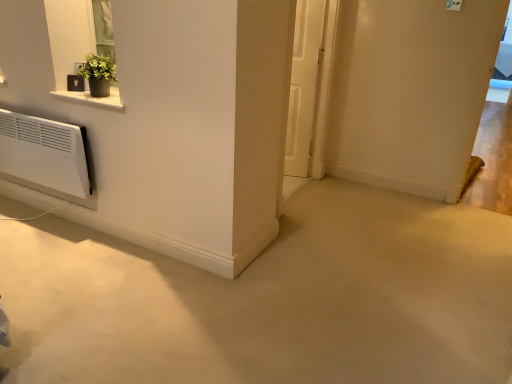
What is the approximate width of green matte plant at upper left?

green matte plant at upper left is 16.52 centimeters in width.

This screenshot has height=384, width=512. In order to click on green matte plant at upper left in this screenshot , I will do `click(98, 74)`.

Describe the element at coordinates (98, 74) in the screenshot. I see `green matte plant at upper left` at that location.

What do you see at coordinates (304, 85) in the screenshot?
I see `white matte door at center` at bounding box center [304, 85].

This screenshot has width=512, height=384. Identify the location of white matte door at center. (304, 85).

What is the approximate height of white matte door at center?

It is 1.40 meters.

The image size is (512, 384). Identify the location of green matte plant at upper left. (98, 74).

Between green matte plant at upper left and white matte door at center, which one appears on the left side from the viewer's perspective?

green matte plant at upper left.

Between green matte plant at upper left and white matte door at center, which one is positioned behind?

white matte door at center is behind.

Which is closer, (x=100, y=85) or (x=297, y=19)?

Clearly, point (x=100, y=85) is closer to the camera than point (x=297, y=19).

From the image's perspective, is green matte plant at upper left located above white matte door at center?

Actually, green matte plant at upper left appears below white matte door at center in the image.

From a real-world perspective, is green matte plant at upper left below white matte door at center?

No, from a real-world perspective, green matte plant at upper left is not below white matte door at center.

Considering the sizes of objects green matte plant at upper left and white matte door at center in the image provided, who is thinner, green matte plant at upper left or white matte door at center?

With smaller width is white matte door at center.

Considering the sizes of green matte plant at upper left and white matte door at center in the image, is green matte plant at upper left taller or shorter than white matte door at center?

In the image, green matte plant at upper left appears to be shorter than white matte door at center.

Does green matte plant at upper left have a smaller size compared to white matte door at center?

Correct, green matte plant at upper left occupies less space than white matte door at center.

Is green matte plant at upper left inside or outside of white matte door at center?

green matte plant at upper left cannot be found inside white matte door at center.

Is green matte plant at upper left next to white matte door at center and touching it?

green matte plant at upper left and white matte door at center are not in contact.

From the picture: Is green matte plant at upper left facing towards white matte door at center?

No, green matte plant at upper left is not facing towards white matte door at center.

Can you tell me how much green matte plant at upper left and white matte door at center differ in facing direction?

15.9 degrees.

Measure the distance between green matte plant at upper left and white matte door at center.

green matte plant at upper left and white matte door at center are 4.99 feet apart from each other.

This screenshot has height=384, width=512. I want to click on door located underneath the green matte plant at upper left (from a real-world perspective), so click(304, 85).

Between white matte door at center and green matte plant at upper left, which one appears on the left side from the viewer's perspective?

From the viewer's perspective, green matte plant at upper left appears more on the left side.

Which object is closer to the camera, white matte door at center or green matte plant at upper left?

Positioned in front is green matte plant at upper left.

Considering the positions of point (297, 88) and point (94, 92), is point (297, 88) closer or farther from the camera than point (94, 92)?

Clearly, point (297, 88) is more distant from the camera than point (94, 92).

From the image's perspective, would you say white matte door at center is positioned over green matte plant at upper left?

Yes, from the image's perspective, white matte door at center is over green matte plant at upper left.

From a real-world perspective, which is physically above, white matte door at center or green matte plant at upper left?

From a 3D spatial view, green matte plant at upper left is above.

Considering the sizes of objects white matte door at center and green matte plant at upper left in the image provided, who is wider, white matte door at center or green matte plant at upper left?

With larger width is green matte plant at upper left.

Considering the relative sizes of white matte door at center and green matte plant at upper left in the image provided, is white matte door at center taller than green matte plant at upper left?

Yes.

Which of these two, white matte door at center or green matte plant at upper left, is bigger?

Bigger between the two is white matte door at center.

Is green matte plant at upper left completely or partially inside white matte door at center?

No, green matte plant at upper left is not inside white matte door at center.

Is white matte door at center far from green matte plant at upper left?

Absolutely, white matte door at center is distant from green matte plant at upper left.

Is white matte door at center turned away from green matte plant at upper left?

No, green matte plant at upper left is not at the back of white matte door at center.

Locate an element on the screen. This screenshot has width=512, height=384. houseplant in front of the white matte door at center is located at coordinates (98, 74).

Find the location of `houseplant above the white matte door at center (from a real-world perspective)`. houseplant above the white matte door at center (from a real-world perspective) is located at coordinates (98, 74).

Locate an element on the screen. houseplant lying in front of the white matte door at center is located at coordinates (98, 74).